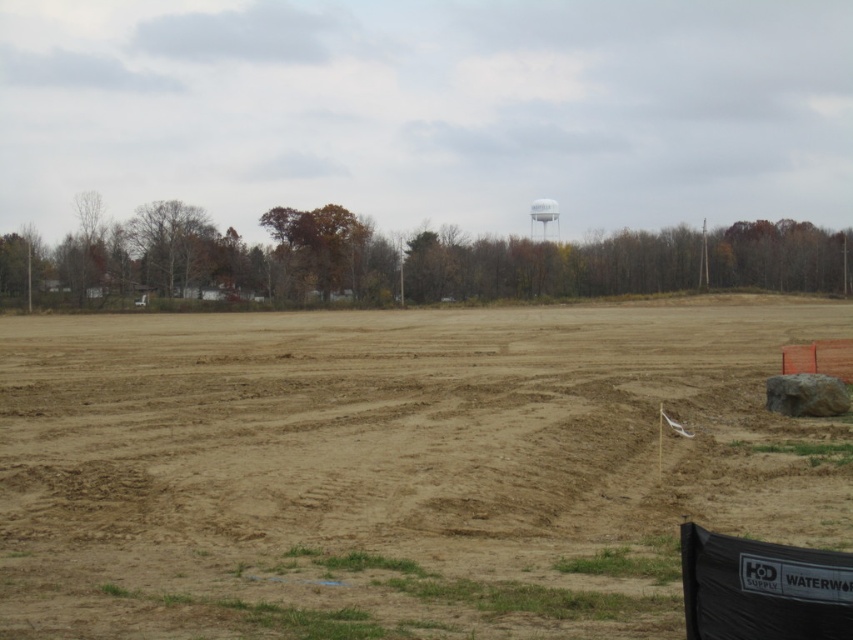
You are standing at the point labeled point (x=396, y=468) in the image. What type of terrain are you currently standing on?

The point (x=396, y=468) corresponds to the brown sandy dirt field at center, so you are standing on a brown sandy dirt field.

You are a surveyor trying to determine the elevation differences in the scene. Based on the image, which object is lower in height between the brown sandy dirt field at center and the white matte water tower at upper center?

The brown sandy dirt field at center is not as tall as the white matte water tower at upper center, so the dirt field is lower in elevation.

You are a construction worker who needs to place a new equipment that requires a large flat area. Based on the scene, which object from the list would be the best location for placing the equipment? Please choose between the brown sandy dirt field at center and the white matte water tower at upper center.

The brown sandy dirt field at center is larger in size than the white matte water tower at upper center, so the best location for placing the equipment would be the brown sandy dirt field at center as it provides a sufficient flat area.